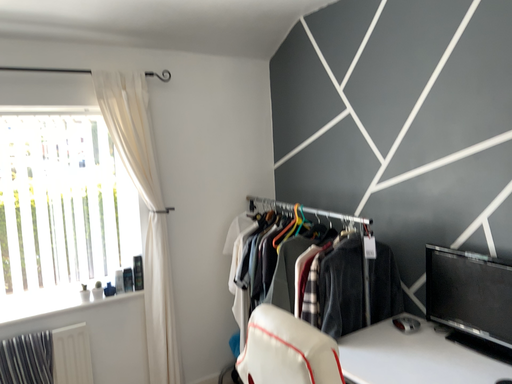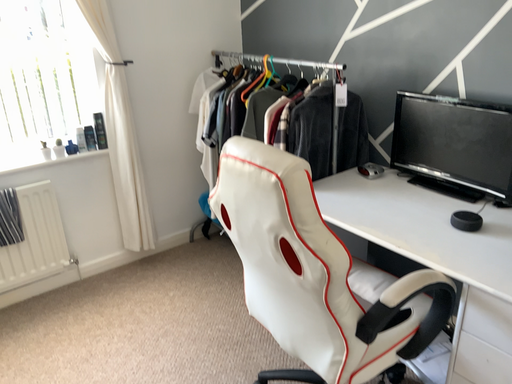
Question: How did the camera likely rotate when shooting the video?

Choices:
 (A) rotated downward
 (B) rotated upward

Answer: (A)